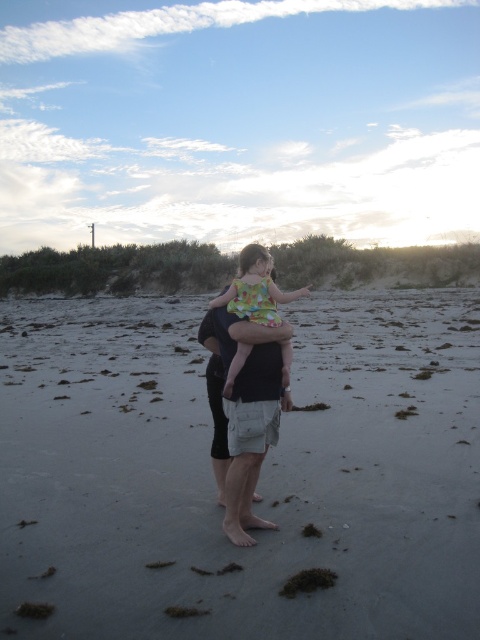
Who is positioned more to the left, dark gray shorts at center or floral fabric dress at center?

Positioned to the left is floral fabric dress at center.

Does dark gray shorts at center appear on the left side of floral fabric dress at center?

No, dark gray shorts at center is not to the left of floral fabric dress at center.

Does point (232, 346) lie behind point (233, 376)?

Yes, it is behind point (233, 376).

Identify the location of dark gray shorts at center. This screenshot has height=640, width=480. (249, 355).

Is gray sand at center taller than floral fabric dress at center?

Yes, gray sand at center is taller than floral fabric dress at center.

Who is more forward, (300, 563) or (265, 308)?

Point (300, 563) is more forward.

The height and width of the screenshot is (640, 480). Identify the location of gray sand at center. (259, 481).

Measure the distance between point (x=327, y=531) and camera.

Point (x=327, y=531) and camera are 15.54 feet apart.

Between gray sand at center and dark gray shorts at center, which one has less height?

With less height is dark gray shorts at center.

What do you see at coordinates (259, 481) in the screenshot? The width and height of the screenshot is (480, 640). I see `gray sand at center` at bounding box center [259, 481].

Where is `gray sand at center`? The image size is (480, 640). gray sand at center is located at coordinates (259, 481).